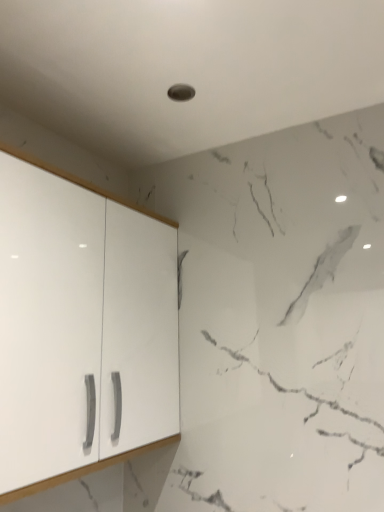
This screenshot has width=384, height=512. What do you see at coordinates (81, 327) in the screenshot? I see `white glossy cabinet at left` at bounding box center [81, 327].

What is the approximate width of white glossy cabinet at left?

white glossy cabinet at left is 10.81 inches in width.

Where is `white glossy cabinet at left`? The height and width of the screenshot is (512, 384). white glossy cabinet at left is located at coordinates (81, 327).

Looking at this image, measure the distance between white glossy cabinet at left and camera.

The depth of white glossy cabinet at left is 33.93 inches.

Where is `white glossy cabinet at left`? This screenshot has height=512, width=384. white glossy cabinet at left is located at coordinates (81, 327).